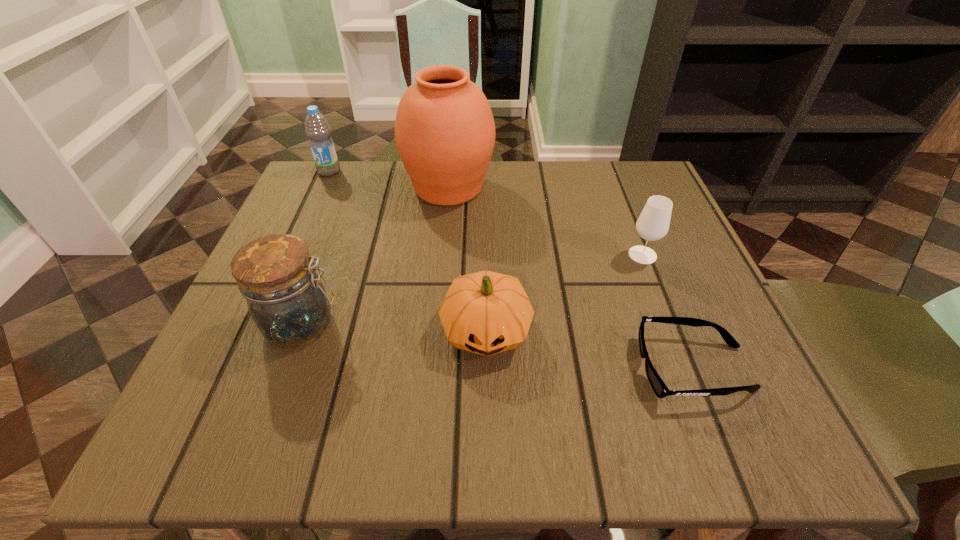
Identify the location of vacant area situated 0.060m on the side of the gourd with the carved face. Image resolution: width=960 pixels, height=540 pixels. (487, 406).

Find the location of `free location located on the front-facing side of the shortest object`. free location located on the front-facing side of the shortest object is located at coordinates (554, 368).

At what (x,y) coordinates should I click in order to perform the action: click on vacant space situated 0.320m on the front-facing side of the shortest object. Please return your answer as a coordinate pair (x, y). The width and height of the screenshot is (960, 540). Looking at the image, I should click on (429, 368).

Find the location of a particular element. vacant area situated on the front-facing side of the shortest object is located at coordinates (377, 368).

I want to click on urn at the far edge, so click(x=444, y=129).

Locate an element on the screen. The image size is (960, 540). water bottle that is at the far edge is located at coordinates (317, 129).

Where is `object present at the near edge`? object present at the near edge is located at coordinates (660, 389).

Where is `water bottle located in the left edge section of the desktop`? The height and width of the screenshot is (540, 960). water bottle located in the left edge section of the desktop is located at coordinates (317, 129).

Image resolution: width=960 pixels, height=540 pixels. Identify the location of jar that is at the left edge. (286, 299).

At what (x,y) coordinates should I click in order to perform the action: click on glass at the right edge. Please return your answer as a coordinate pair (x, y). This screenshot has width=960, height=540. Looking at the image, I should click on (653, 223).